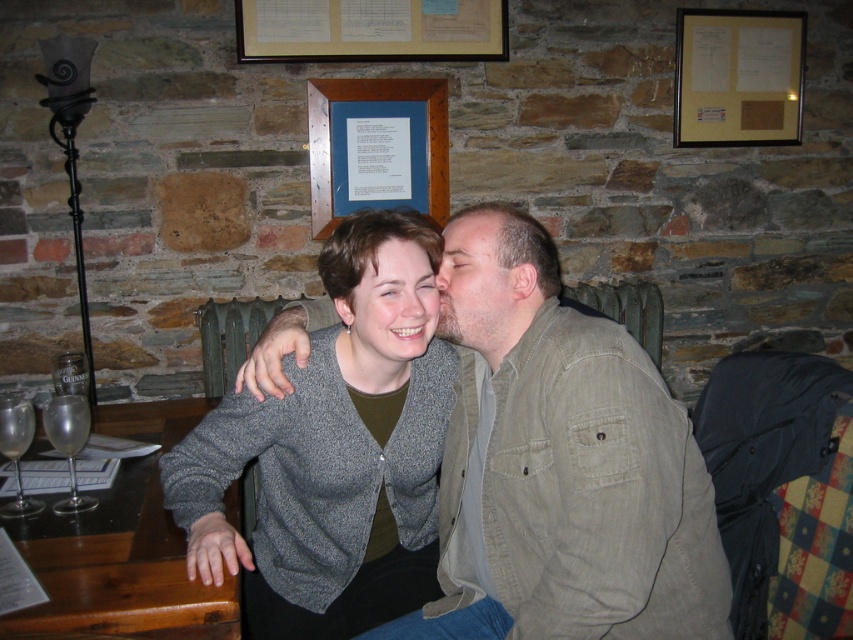
Question: Which object appears closest to the camera in this image?

Choices:
 (A) matte gray sweater at center
 (B) matte skin forehead at center

Answer: (B)

Question: Can you confirm if blue matte picture frame at upper center is wider than clear glass wine at lower left?

Choices:
 (A) no
 (B) yes

Answer: (B)

Question: Does gray wool sweater at center have a lesser width compared to matte skin forehead at center?

Choices:
 (A) no
 (B) yes

Answer: (A)

Question: Which point appears farthest from the camera in this image?

Choices:
 (A) (71, 484)
 (B) (4, 416)
 (C) (569, 435)
 (D) (294, 22)

Answer: (D)

Question: Can you confirm if wooden framed paper at upper center is thinner than matte skin forehead at center?

Choices:
 (A) yes
 (B) no

Answer: (B)

Question: Which of the following is the closest to the observer?

Choices:
 (A) matte gray sweater at center
 (B) wooden framed paper at upper center
 (C) white paper at upper center

Answer: (A)